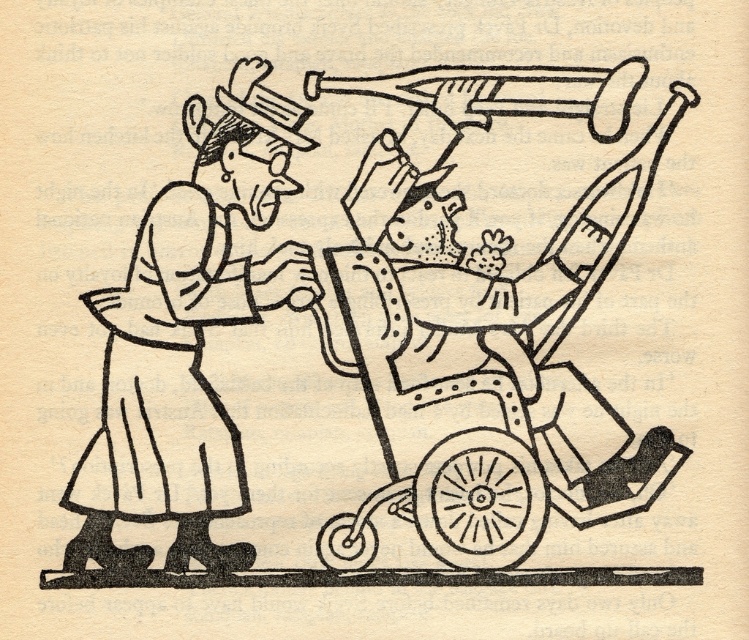
Question: Which point is farther to the camera?

Choices:
 (A) metallic baby carriage at center
 (B) smooth white dress at left

Answer: (B)

Question: Can you confirm if metallic baby carriage at center is positioned below smooth white dress at left?

Choices:
 (A) yes
 (B) no

Answer: (A)

Question: Is metallic baby carriage at center to the right of smooth white dress at left from the viewer's perspective?

Choices:
 (A) no
 (B) yes

Answer: (B)

Question: Does metallic baby carriage at center appear over smooth white dress at left?

Choices:
 (A) no
 (B) yes

Answer: (A)